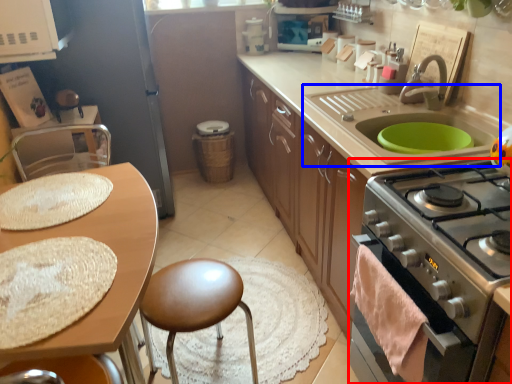
Question: Which of the following is the farthest to the observer, kitchen appliance (highlighted by a red box) or sink (highlighted by a blue box)?

Choices:
 (A) kitchen appliance
 (B) sink

Answer: (B)